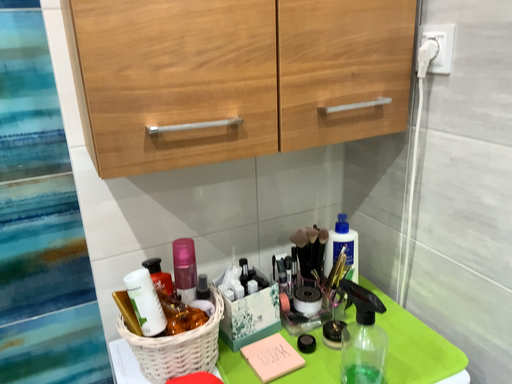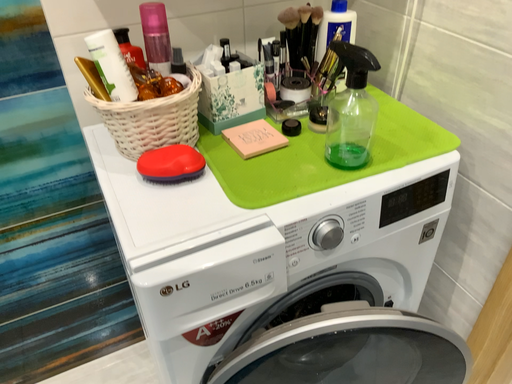
Question: Which way did the camera rotate in the video?

Choices:
 (A) rotated downward
 (B) rotated upward

Answer: (A)